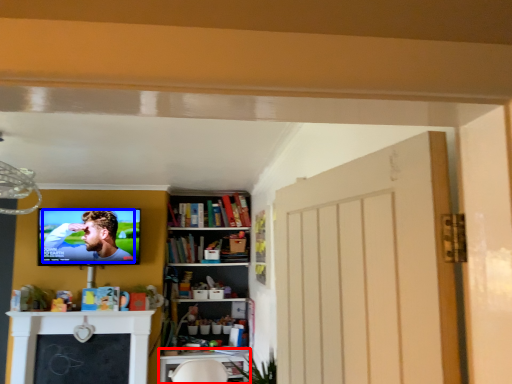
Question: Which object appears closest to the camera in this image, table (highlighted by a red box) or person (highlighted by a blue box)?

Choices:
 (A) table
 (B) person

Answer: (B)